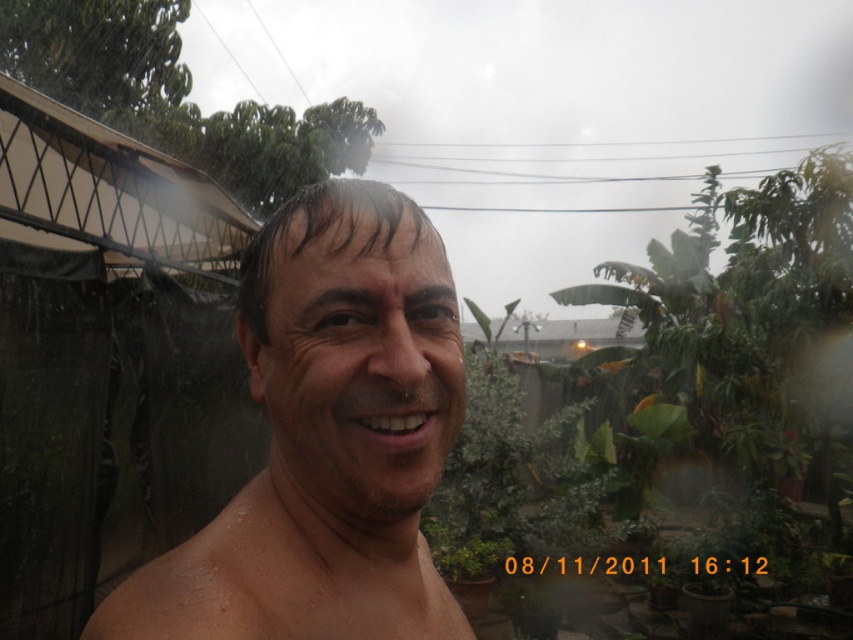
Question: Which object appears farthest from the camera in this image?

Choices:
 (A) wet skin face at center
 (B) green leafy plant at center

Answer: (B)

Question: Considering the relative positions of wet skin face at center and green leafy plant at center in the image provided, where is wet skin face at center located with respect to green leafy plant at center?

Choices:
 (A) above
 (B) below

Answer: (B)

Question: Which point appears farthest from the camera in this image?

Choices:
 (A) (260, 323)
 (B) (824, 433)

Answer: (B)

Question: Which point appears farthest from the camera in this image?

Choices:
 (A) pyautogui.click(x=851, y=224)
 (B) pyautogui.click(x=418, y=380)

Answer: (A)

Question: Is wet skin face at center closer to camera compared to green leafy plant at center?

Choices:
 (A) no
 (B) yes

Answer: (B)

Question: Can you confirm if wet skin face at center is wider than green leafy plant at center?

Choices:
 (A) yes
 (B) no

Answer: (B)